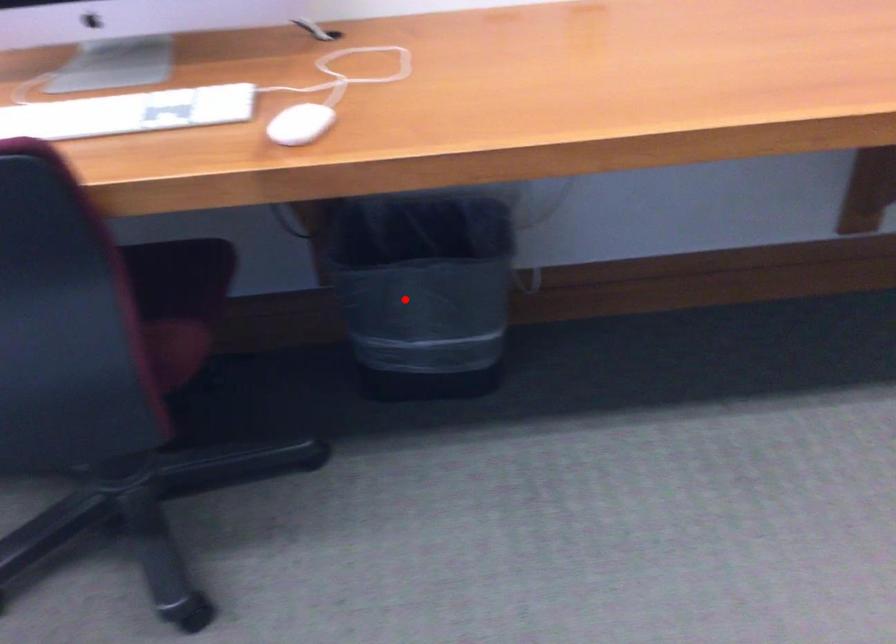
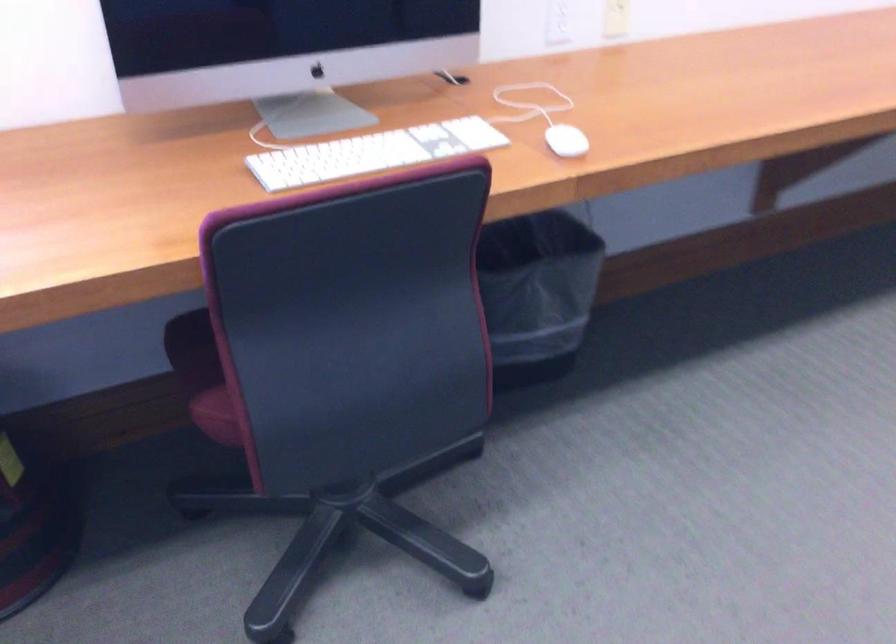
In the second image, find the point that corresponds to the highlighted location in the first image.

(536, 292)